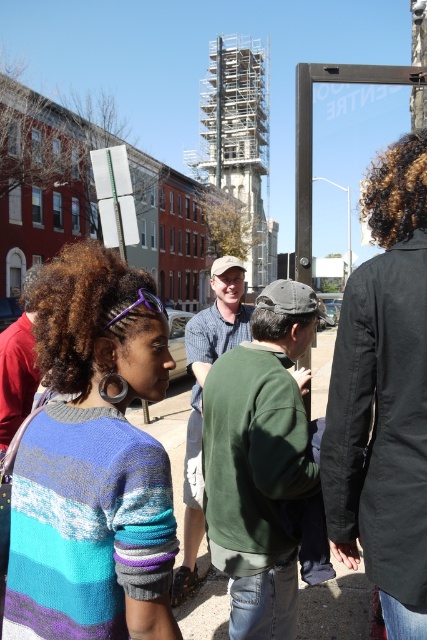
Question: Is green matte sweatshirt at center in front of checkered shirt at center?

Choices:
 (A) yes
 (B) no

Answer: (A)

Question: Is knitted sweater at center wider than checkered shirt at center?

Choices:
 (A) yes
 (B) no

Answer: (B)

Question: Based on their relative distances, which object is nearer to the knitted sweater at center?

Choices:
 (A) green matte sweatshirt at center
 (B) checkered shirt at center

Answer: (A)

Question: Does knitted sweater at center appear on the right side of checkered shirt at center?

Choices:
 (A) no
 (B) yes

Answer: (A)

Question: Which object is positioned closest to the knitted sweater at center?

Choices:
 (A) checkered shirt at center
 (B) green matte sweatshirt at center

Answer: (B)

Question: Which point is closer to the camera?

Choices:
 (A) knitted sweater at center
 (B) checkered shirt at center
 (C) green matte sweatshirt at center

Answer: (A)